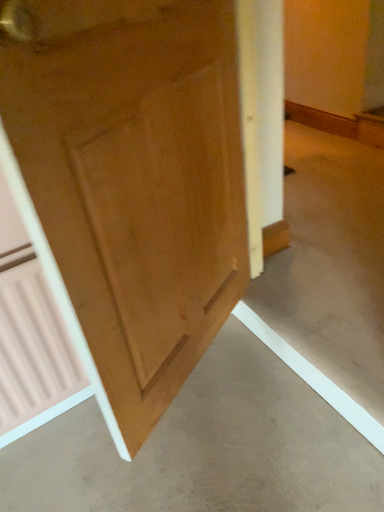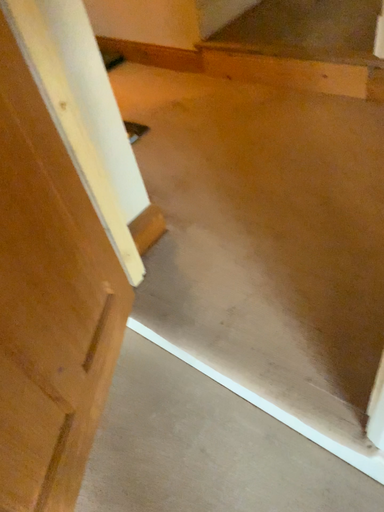
Question: How did the camera likely rotate when shooting the video?

Choices:
 (A) rotated downward
 (B) rotated upward

Answer: (A)